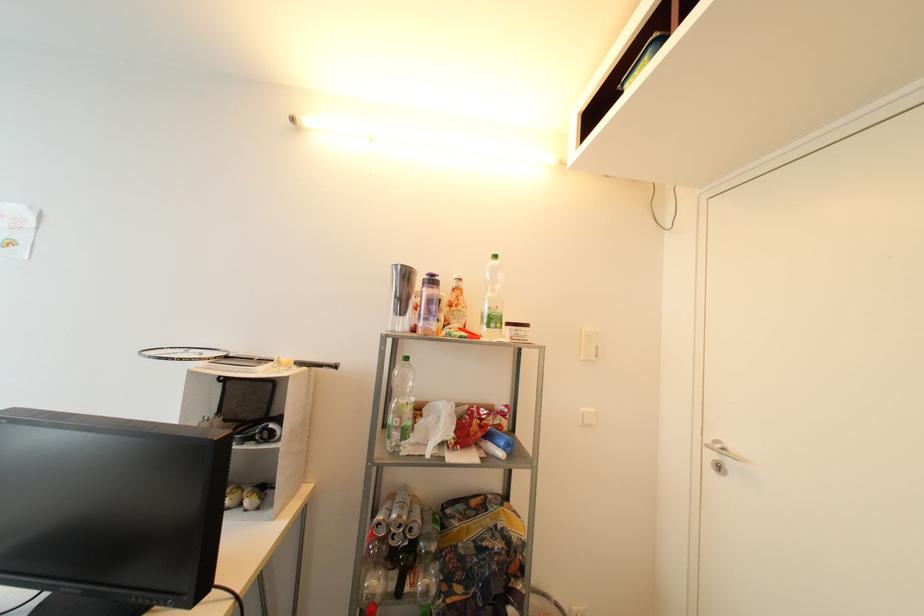
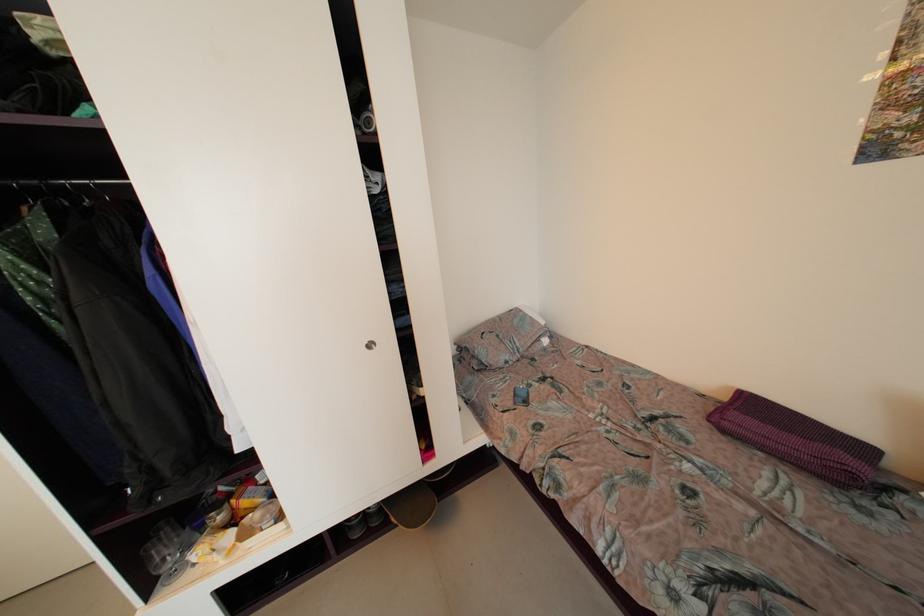
The first image is from the beginning of the video and the second image is from the end. How did the camera likely rotate when shooting the video?

The rotation direction of the camera is right-down.